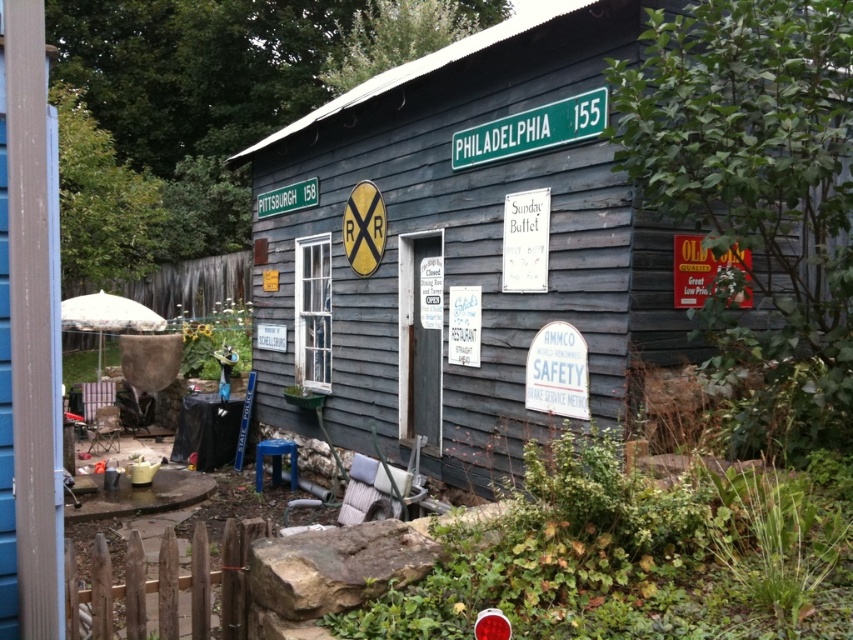
From the picture: You are standing outside the rustic wooden building and want to determine the relative positions of two points marked on its exterior. Which point is closer to you, point (x=379, y=321) or point (x=601, y=115)?

Point (x=379, y=321) is further to the viewer than point (x=601, y=115), so point (x=601, y=115) is closer to you.

You are standing in front of a weathered wood hut at center. If you want to reach the entrance, which is 1.2 meters wide, can you walk straight ahead without needing to move sideways?

The distance between you and the weathered wood hut at center is 3.91 meters, so yes, you can walk straight ahead to reach the entrance without needing to move sideways since the entrance is 1.2 meters wide and the distance is sufficient.

You are standing in front of the weathered wood hut at center and want to place a new sign. Since the green plastic street sign at upper center is already there, can you place your new sign in front of it without it being blocked?

The weathered wood hut at center is closer to the viewer than the green plastic street sign at upper center, so placing a new sign in front of the existing green plastic street sign at upper center would place it between you and the sign, making it visible.